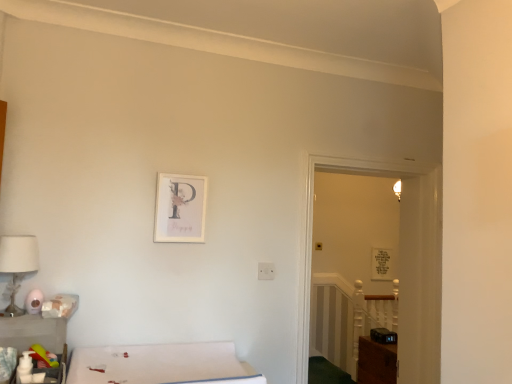
The height and width of the screenshot is (384, 512). Find the location of `vacant space underneath white fabric lampshade at left (from a real-world perspective)`. vacant space underneath white fabric lampshade at left (from a real-world perspective) is located at coordinates (11, 312).